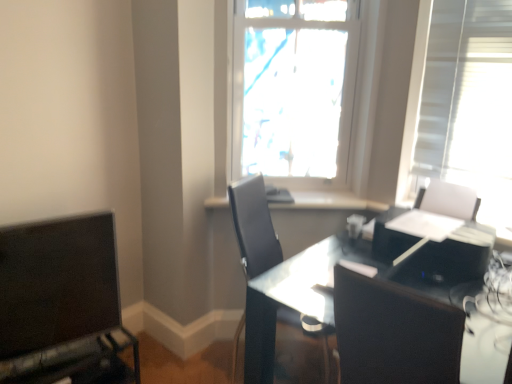
Question: Does matte black monitor at lower left come in front of black leather chair at center?

Choices:
 (A) yes
 (B) no

Answer: (A)

Question: Does matte black monitor at lower left have a greater height compared to black leather chair at center?

Choices:
 (A) yes
 (B) no

Answer: (B)

Question: Considering the relative positions of matte black monitor at lower left and black leather chair at center in the image provided, is matte black monitor at lower left to the left of black leather chair at center from the viewer's perspective?

Choices:
 (A) yes
 (B) no

Answer: (A)

Question: Can you confirm if matte black monitor at lower left is bigger than black leather chair at center?

Choices:
 (A) no
 (B) yes

Answer: (A)

Question: Considering the relative sizes of matte black monitor at lower left and black leather chair at center in the image provided, is matte black monitor at lower left wider than black leather chair at center?

Choices:
 (A) no
 (B) yes

Answer: (A)

Question: From a real-world perspective, is matte black monitor at lower left above or below transparent glass table at center?

Choices:
 (A) above
 (B) below

Answer: (A)

Question: Looking at the image, does matte black monitor at lower left seem bigger or smaller compared to transparent glass table at center?

Choices:
 (A) big
 (B) small

Answer: (B)

Question: In terms of width, does matte black monitor at lower left look wider or thinner when compared to transparent glass table at center?

Choices:
 (A) thin
 (B) wide

Answer: (A)

Question: From the image's perspective, is matte black monitor at lower left positioned above or below transparent glass table at center?

Choices:
 (A) below
 (B) above

Answer: (B)

Question: From their relative heights in the image, would you say black leather chair at center is taller or shorter than white glossy window sill at center?

Choices:
 (A) short
 (B) tall

Answer: (B)

Question: Based on their sizes in the image, would you say black leather chair at center is bigger or smaller than white glossy window sill at center?

Choices:
 (A) big
 (B) small

Answer: (A)

Question: In terms of width, does black leather chair at center look wider or thinner when compared to white glossy window sill at center?

Choices:
 (A) wide
 (B) thin

Answer: (A)

Question: Is black leather chair at center inside or outside of white glossy window sill at center?

Choices:
 (A) outside
 (B) inside

Answer: (A)

Question: Is matte black monitor at lower left taller or shorter than white glossy window sill at center?

Choices:
 (A) short
 (B) tall

Answer: (B)

Question: Is matte black monitor at lower left wider or thinner than white glossy window sill at center?

Choices:
 (A) thin
 (B) wide

Answer: (A)